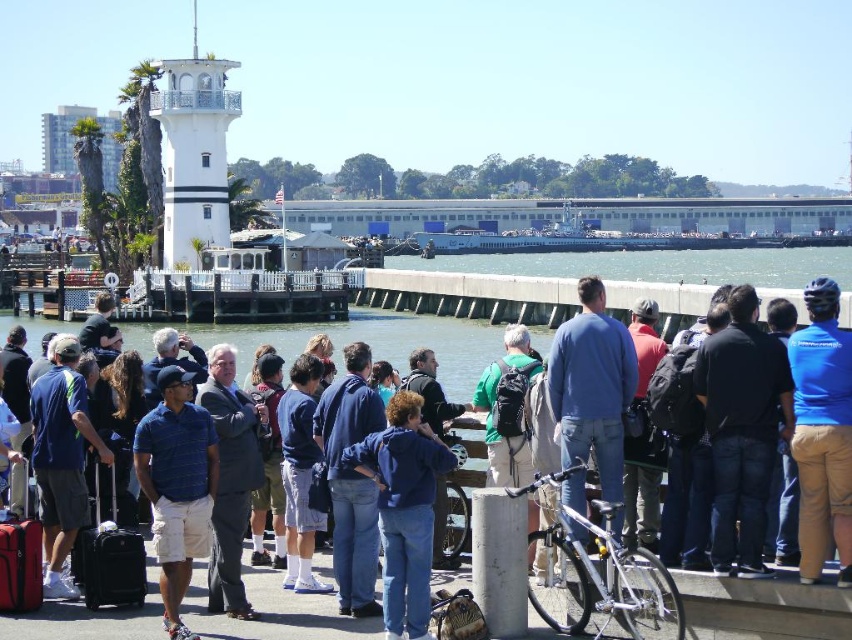
Is blue denim jacket at center taller than matte black suitcase at lower left?

Indeed, blue denim jacket at center has a greater height compared to matte black suitcase at lower left.

Where is `blue denim jacket at center`? The image size is (852, 640). blue denim jacket at center is located at coordinates (403, 508).

Which of these two, blue cotton shirt at center or black hard suitcase at center, stands shorter?

Standing shorter between the two is black hard suitcase at center.

What do you see at coordinates (300, 474) in the screenshot? This screenshot has height=640, width=852. I see `blue cotton shirt at center` at bounding box center [300, 474].

Which is in front, point (308, 408) or point (98, 593)?

Point (98, 593) is more forward.

At what (x,y) coordinates should I click in order to perform the action: click on blue cotton shirt at center. Please return your answer as a coordinate pair (x, y). This screenshot has height=640, width=852. Looking at the image, I should click on pos(300,474).

Does blue cotton shirt at center have a smaller size compared to matte black suitcase at lower left?

No.

Is the position of blue cotton shirt at center more distant than that of matte black suitcase at lower left?

Yes, blue cotton shirt at center is further from the viewer.

Describe the element at coordinates (300, 474) in the screenshot. I see `blue cotton shirt at center` at that location.

In order to click on blue cotton shirt at center in this screenshot , I will do `click(300, 474)`.